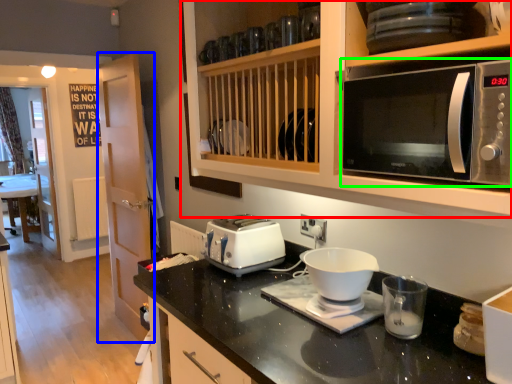
Question: Which is farther away from cabinetry (highlighted by a red box)? glass door (highlighted by a blue box) or microwave oven (highlighted by a green box)?

Choices:
 (A) glass door
 (B) microwave oven

Answer: (A)